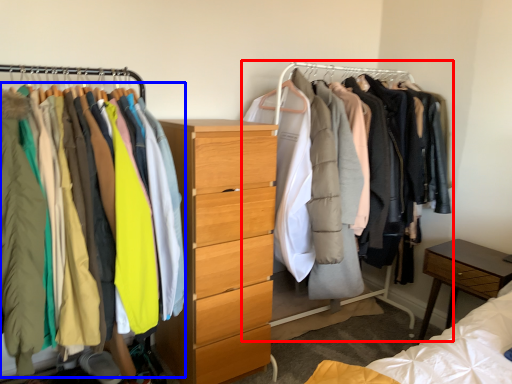
Question: Which of the following is the closest to the observer, closet (highlighted by a red box) or clothing (highlighted by a blue box)?

Choices:
 (A) closet
 (B) clothing

Answer: (B)